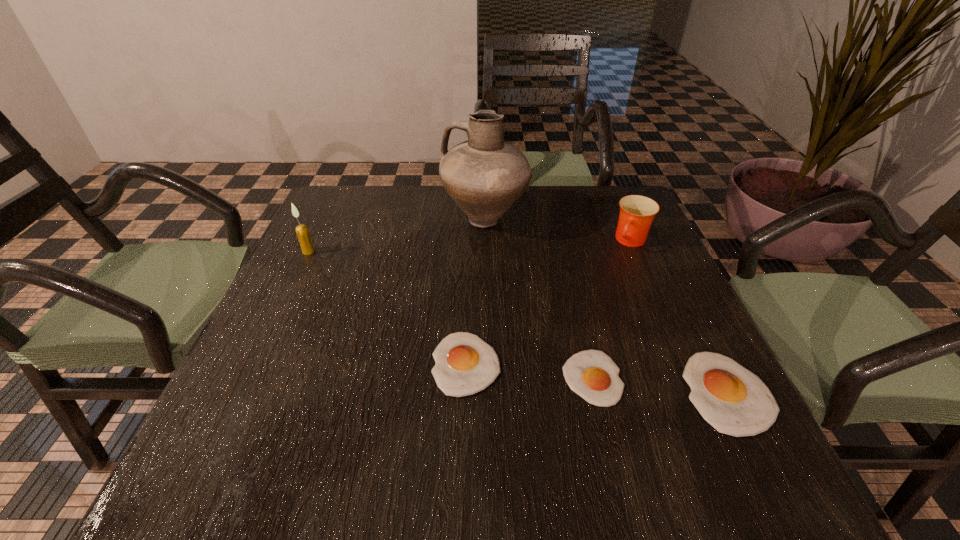
Where is `egg yolk that is positioned at the right edge`? egg yolk that is positioned at the right edge is located at coordinates (732, 399).

The width and height of the screenshot is (960, 540). Identify the location of cup that is at the right edge. (637, 212).

The image size is (960, 540). I want to click on object positioned at the far right corner, so click(x=637, y=212).

Identify the location of object located at the near right corner. pyautogui.click(x=732, y=399).

In the image, there is a desktop. In order to click on vacant space at the far edge in this screenshot , I will do `click(535, 218)`.

This screenshot has width=960, height=540. In order to click on free spot at the near edge of the desktop in this screenshot , I will do tap(390, 415).

Locate an element on the screen. vacant space at the left edge is located at coordinates (308, 354).

Locate an element on the screen. vacant space at the right edge is located at coordinates (606, 252).

Where is `vacant space at the far left corner of the desktop`? vacant space at the far left corner of the desktop is located at coordinates (376, 204).

In the image, there is a desktop. At what (x,y) coordinates should I click in order to perform the action: click on free space at the near left corner. Please return your answer as a coordinate pair (x, y). Image resolution: width=960 pixels, height=540 pixels. Looking at the image, I should click on point(281,396).